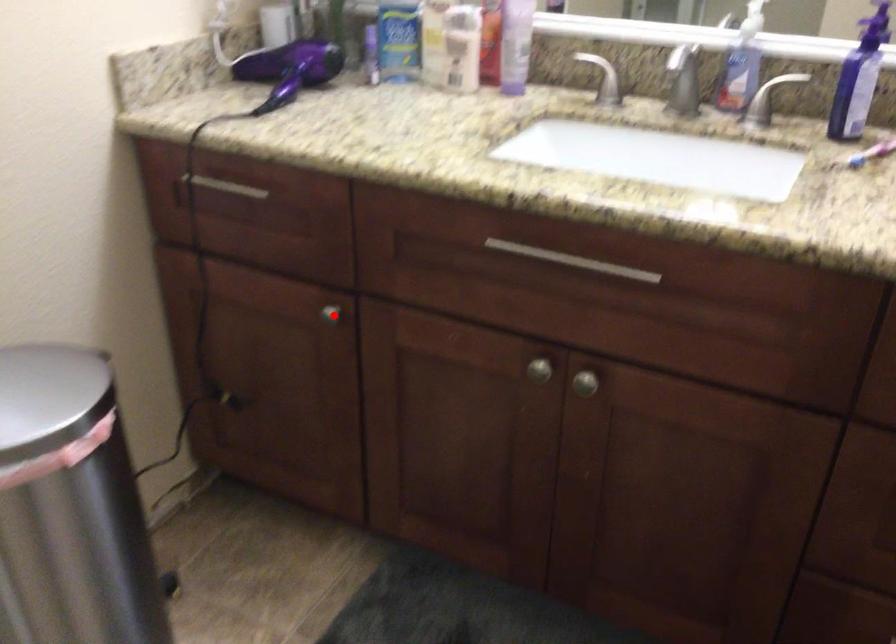
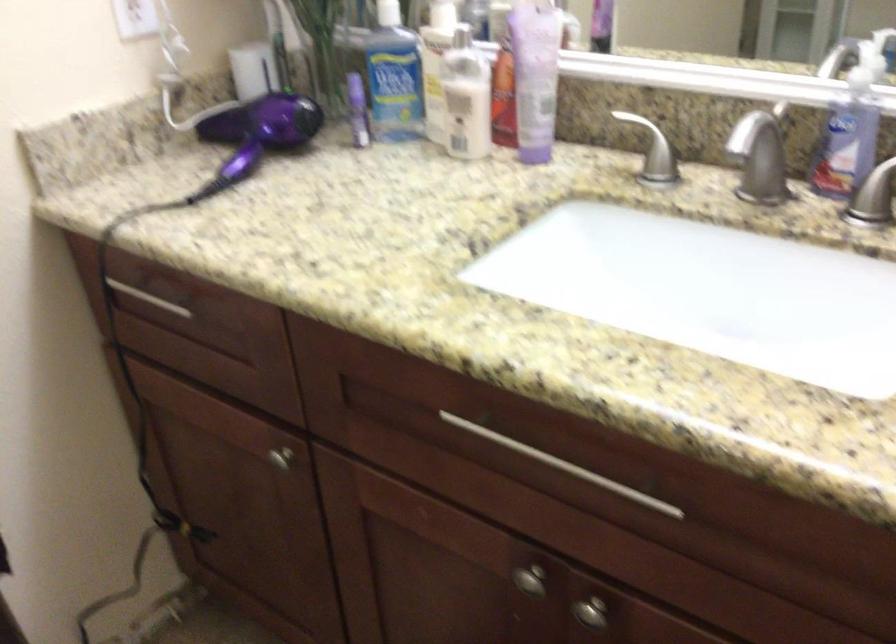
Locate, in the second image, the point that corresponds to the highlighted location in the first image.

(280, 459)